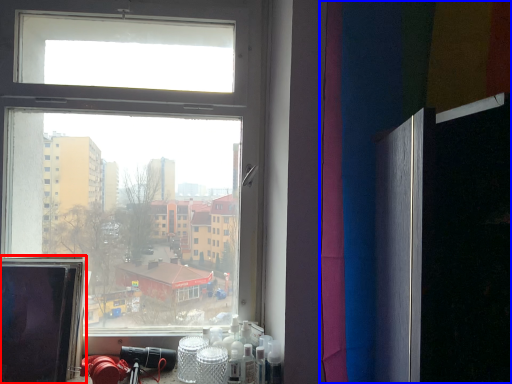
Question: Which point is closer to the camera, computer screen (highlighted by a red box) or curtain (highlighted by a blue box)?

Choices:
 (A) computer screen
 (B) curtain

Answer: (B)